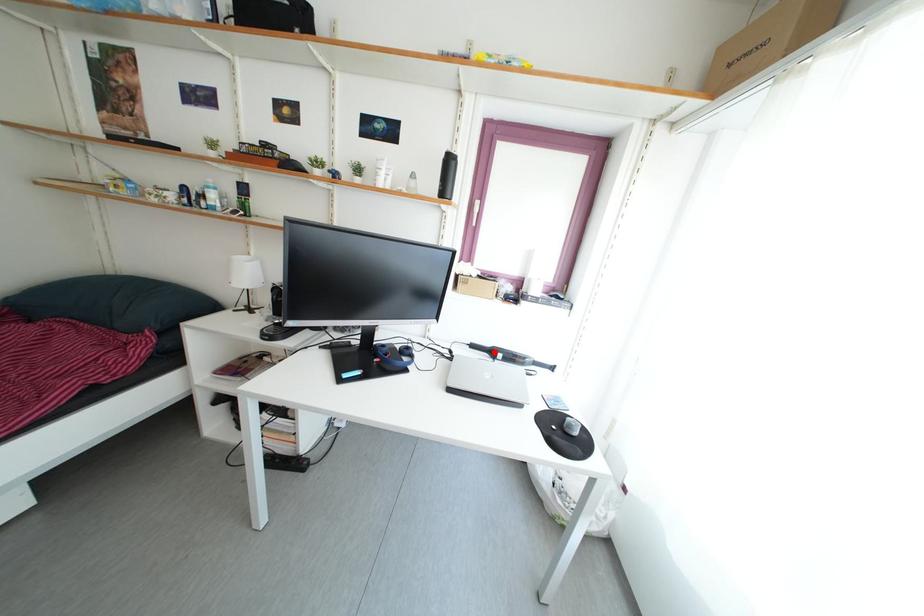
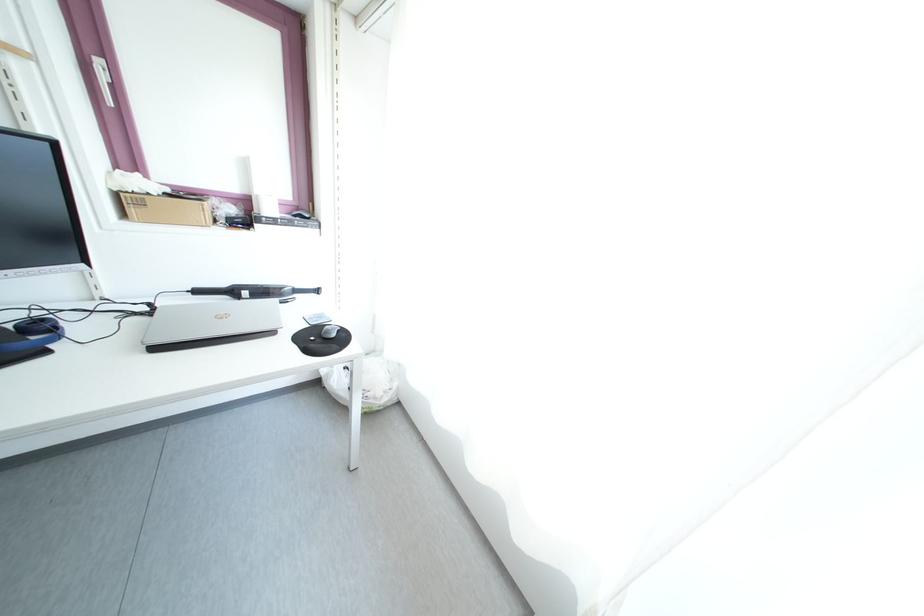
Where in the second image is the point corresponding to the highlighted location from the first image?

(229, 293)